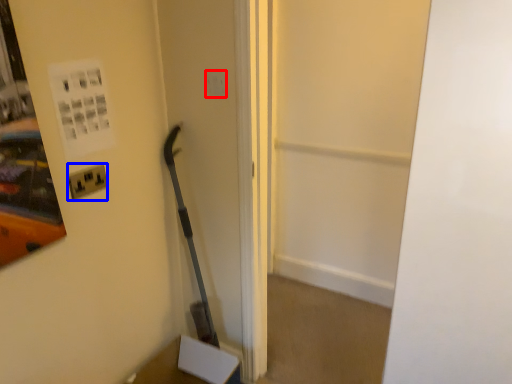
Question: Which object appears farthest to the camera in this image, light switch (highlighted by a red box) or electric outlet (highlighted by a blue box)?

Choices:
 (A) light switch
 (B) electric outlet

Answer: (A)